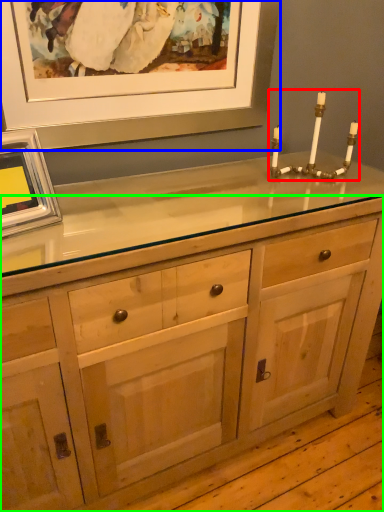
Question: Which object is positioned closest to candle holder (highlighted by a red box)? Select from picture frame (highlighted by a blue box) and chest of drawers (highlighted by a green box).

Choices:
 (A) picture frame
 (B) chest of drawers

Answer: (A)